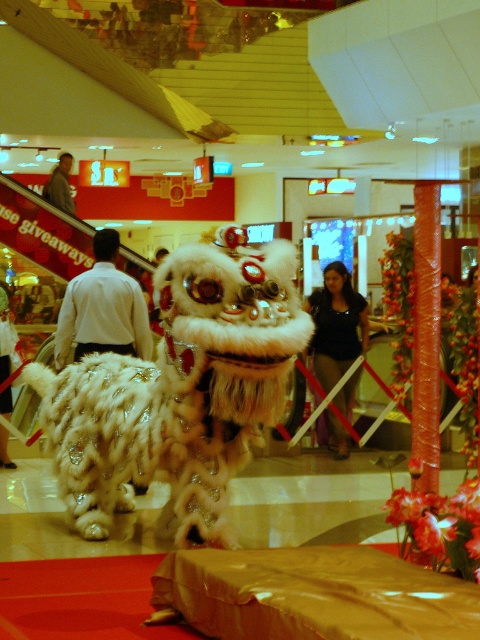
Question: Which object is the closest to the gray fabric jacket at upper left?

Choices:
 (A) white fur coat at center
 (B) white fluffy lion at center

Answer: (B)

Question: Which of the following is the closest to the observer?

Choices:
 (A) (359, 321)
 (B) (148, 339)
 (C) (64, 161)

Answer: (B)

Question: Can you confirm if white fur coat at center is bigger than white fluffy lion at center?

Choices:
 (A) yes
 (B) no

Answer: (B)

Question: Estimate the real-world distances between objects in this image. Which object is closer to the white fluffy lion at center?

Choices:
 (A) white fur coat at center
 (B) gray fabric jacket at upper left

Answer: (A)

Question: Does white fluffy lion at center have a smaller size compared to gray fabric jacket at upper left?

Choices:
 (A) yes
 (B) no

Answer: (A)

Question: Is white fur coat at center wider than gray fabric jacket at upper left?

Choices:
 (A) yes
 (B) no

Answer: (A)